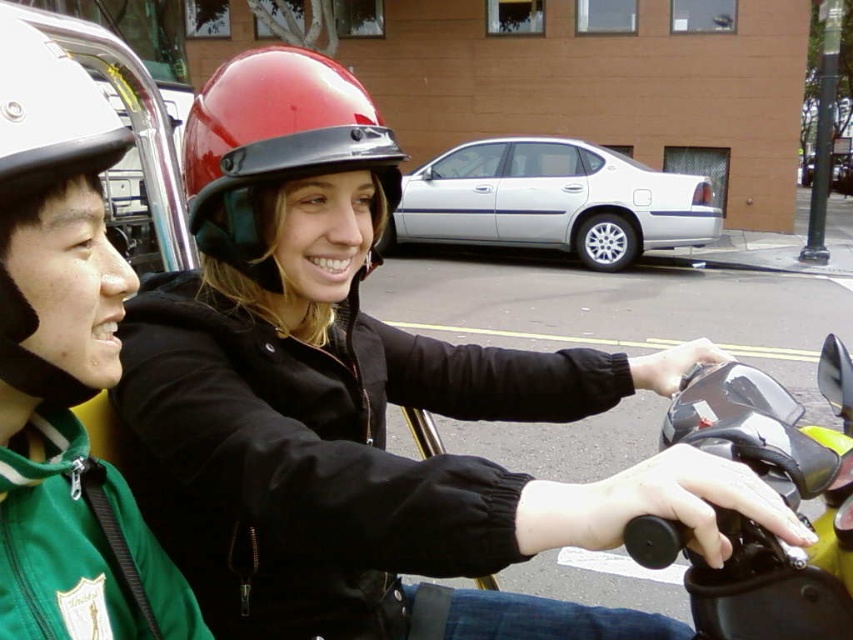
Does red glossy helmet at center have a greater height compared to white matte helmet at left?

Indeed, red glossy helmet at center has a greater height compared to white matte helmet at left.

In the scene shown: Between red glossy helmet at center and white matte helmet at left, which one is positioned lower?

white matte helmet at left is below.

Identify the location of red glossy helmet at center. (274, 147).

In order to click on red glossy helmet at center in this screenshot , I will do `click(274, 147)`.

Is shiny black handlebars at center above red glossy helmet at center?

No.

Is point (685, 552) positioned after point (233, 145)?

That is False.

This screenshot has height=640, width=853. I want to click on shiny black handlebars at center, so click(x=778, y=492).

Does shiny black handlebars at center come in front of white matte helmet at left?

No.

Between shiny black handlebars at center and white matte helmet at left, which one appears on the left side from the viewer's perspective?

From the viewer's perspective, white matte helmet at left appears more on the left side.

What do you see at coordinates (778, 492) in the screenshot? I see `shiny black handlebars at center` at bounding box center [778, 492].

This screenshot has width=853, height=640. I want to click on shiny black handlebars at center, so click(778, 492).